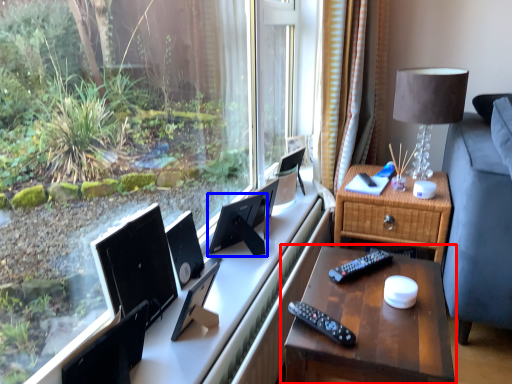
Question: Which of the following is the farthest to the observer, nightstand (highlighted by a red box) or computer monitor (highlighted by a blue box)?

Choices:
 (A) nightstand
 (B) computer monitor

Answer: (B)